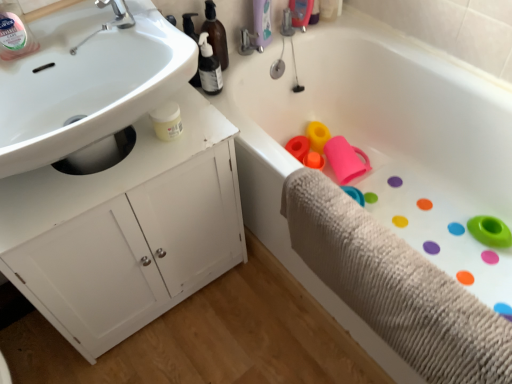
I want to click on vacant space to the right of silver metallic faucet at upper left, so click(155, 26).